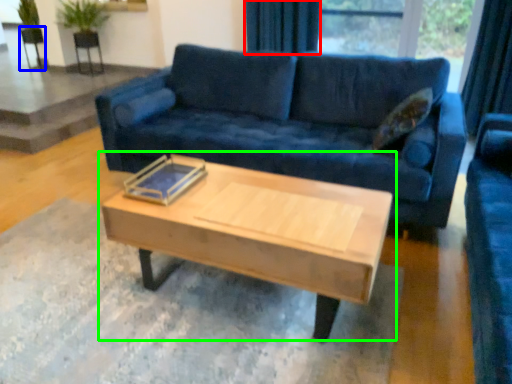
Question: Considering the real-world distances, which object is farthest from curtain (highlighted by a red box)? armchair (highlighted by a blue box) or coffee table (highlighted by a green box)?

Choices:
 (A) armchair
 (B) coffee table

Answer: (A)